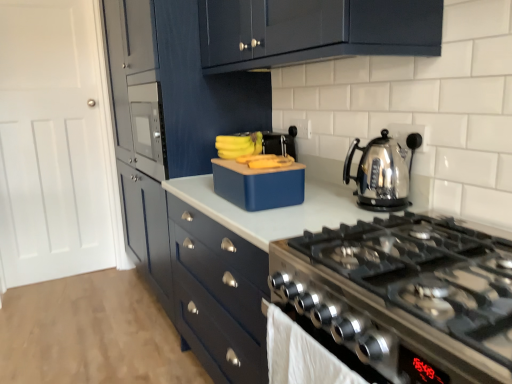
Question: From a real-world perspective, is stainless steel kettle at right on top of matte blue cabinets at center, the 2th cabinetry in the front-to-back sequence?

Choices:
 (A) no
 (B) yes

Answer: (B)

Question: Is the depth of stainless steel kettle at right greater than that of matte blue cabinets at center, the 2th cabinetry in the front-to-back sequence?

Choices:
 (A) no
 (B) yes

Answer: (A)

Question: Can you confirm if stainless steel kettle at right is positioned to the right of matte blue cabinets at center, the 2th cabinetry in the front-to-back sequence?

Choices:
 (A) no
 (B) yes

Answer: (B)

Question: From the image's perspective, is stainless steel kettle at right located beneath matte blue cabinets at center, the 2th cabinetry in the front-to-back sequence?

Choices:
 (A) yes
 (B) no

Answer: (A)

Question: Is stainless steel kettle at right completely or partially outside of matte blue cabinets at center, which is the first cabinetry in back-to-front order?

Choices:
 (A) no
 (B) yes

Answer: (B)

Question: Is point (244, 185) closer or farther from the camera than point (387, 311)?

Choices:
 (A) farther
 (B) closer

Answer: (A)

Question: Looking at their shapes, would you say blue matte lunchbox at center is wider or thinner than stainless steel gas stove at lower right?

Choices:
 (A) wide
 (B) thin

Answer: (B)

Question: Based on their positions, is blue matte lunchbox at center located to the left or right of stainless steel gas stove at lower right?

Choices:
 (A) right
 (B) left

Answer: (B)

Question: Is blue matte lunchbox at center situated inside stainless steel gas stove at lower right or outside?

Choices:
 (A) inside
 (B) outside

Answer: (B)

Question: Does point (291, 175) appear closer or farther from the camera than point (212, 291)?

Choices:
 (A) closer
 (B) farther

Answer: (A)

Question: Is blue matte lunchbox at center taller or shorter than matte blue cabinets at center, which is the first cabinetry in back-to-front order?

Choices:
 (A) short
 (B) tall

Answer: (A)

Question: Is blue matte lunchbox at center situated inside matte blue cabinets at center, which is the first cabinetry in back-to-front order, or outside?

Choices:
 (A) inside
 (B) outside

Answer: (B)

Question: In the image, is blue matte lunchbox at center on the left side or the right side of matte blue cabinets at center, the 2th cabinetry in the front-to-back sequence?

Choices:
 (A) left
 (B) right

Answer: (B)

Question: From their relative heights in the image, would you say matte blue cabinets at center, which is the first cabinetry in back-to-front order, is taller or shorter than white glossy countertop at center?

Choices:
 (A) tall
 (B) short

Answer: (A)

Question: Considering the positions of matte blue cabinets at center, which is the first cabinetry in back-to-front order, and white glossy countertop at center in the image, is matte blue cabinets at center, which is the first cabinetry in back-to-front order, bigger or smaller than white glossy countertop at center?

Choices:
 (A) small
 (B) big

Answer: (B)